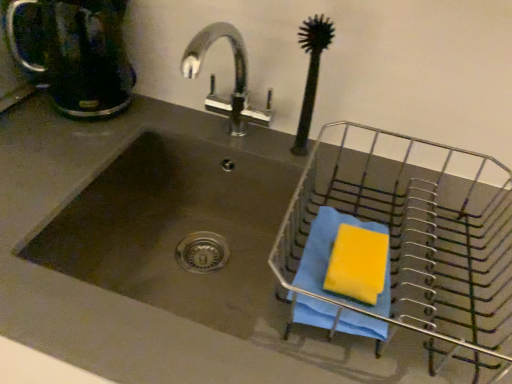
This screenshot has width=512, height=384. I want to click on free space to the left of blue cloth at right, so pos(224,333).